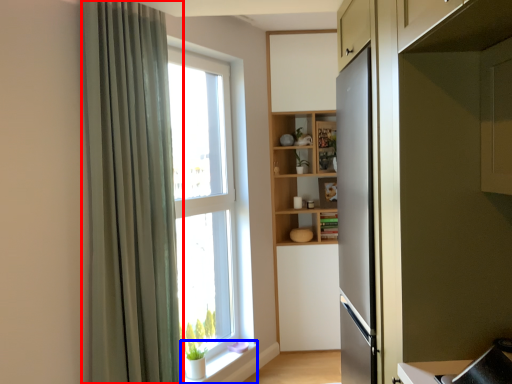
Question: Which object appears closest to the camera in this image, curtain (highlighted by a red box) or window sill (highlighted by a blue box)?

Choices:
 (A) curtain
 (B) window sill

Answer: (A)